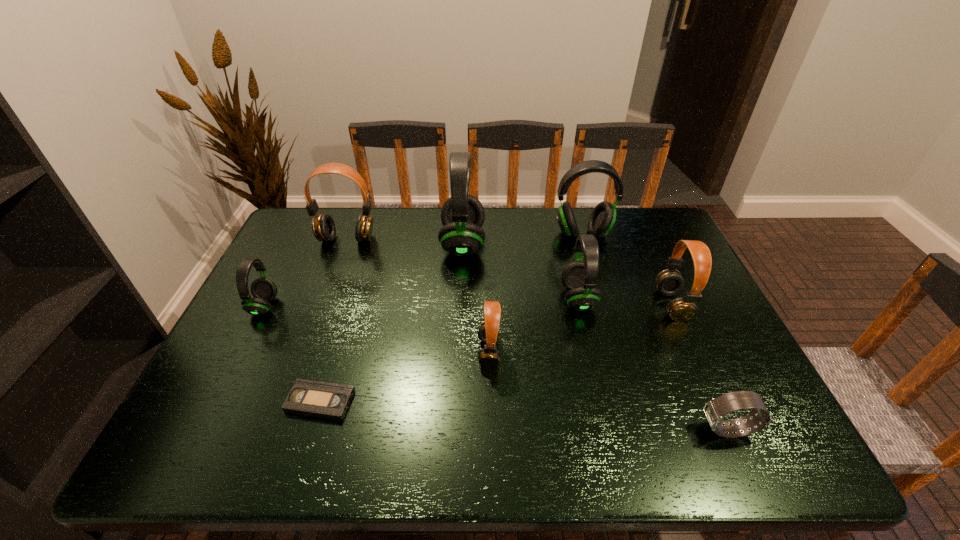
Locate an element on the screen. The width and height of the screenshot is (960, 540). vacant space that satisfies the following two spatial constraints: 1. on the ear cups of the farthest brown headset; 2. on the ear cups of the leftmost headset is located at coordinates (322, 306).

The height and width of the screenshot is (540, 960). I want to click on free spot that satisfies the following two spatial constraints: 1. on the ear cups of the leftmost brown headset; 2. on the ear cups of the smallest black headset, so click(322, 306).